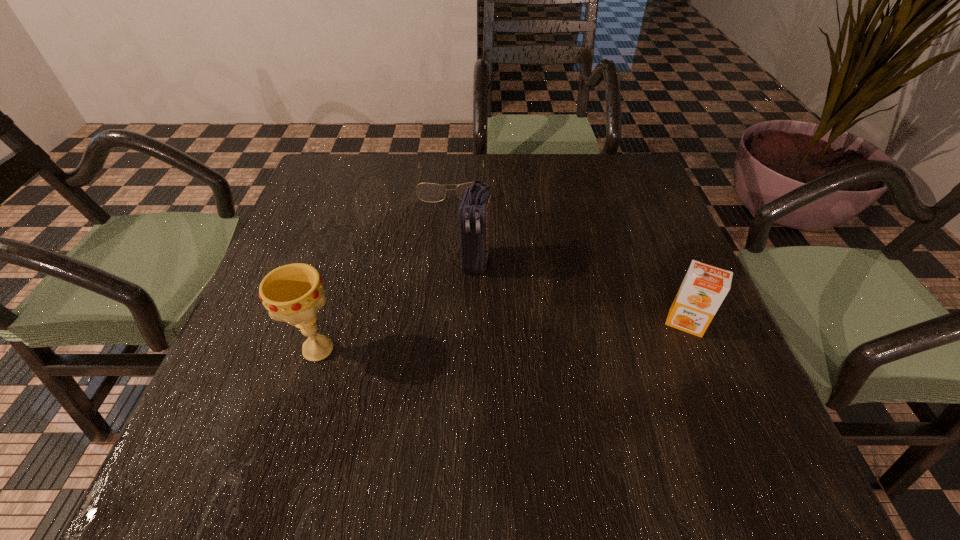
This screenshot has width=960, height=540. In order to click on vacant region located on the front-facing side of the farthest object in this screenshot , I will do `click(452, 218)`.

The height and width of the screenshot is (540, 960). In order to click on vacant region located 0.090m with the zip open on the second farthest object in this screenshot , I will do `click(464, 313)`.

Where is `free space located 0.160m with the zip open on the second farthest object`? Image resolution: width=960 pixels, height=540 pixels. free space located 0.160m with the zip open on the second farthest object is located at coordinates (456, 341).

Where is `free region located 0.300m with the zip open on the second farthest object`? free region located 0.300m with the zip open on the second farthest object is located at coordinates (438, 409).

In order to click on object located at the far edge in this screenshot , I will do `click(428, 192)`.

Where is `object located in the near edge section of the desktop`? The height and width of the screenshot is (540, 960). object located in the near edge section of the desktop is located at coordinates (293, 293).

I want to click on object that is at the left edge, so click(x=293, y=293).

The height and width of the screenshot is (540, 960). Identify the location of object at the right edge. (704, 287).

Find the location of a particular element. This screenshot has height=540, width=960. object located at the near left corner is located at coordinates (293, 293).

This screenshot has height=540, width=960. Find the location of `free spot at the far edge of the desktop`. free spot at the far edge of the desktop is located at coordinates (424, 167).